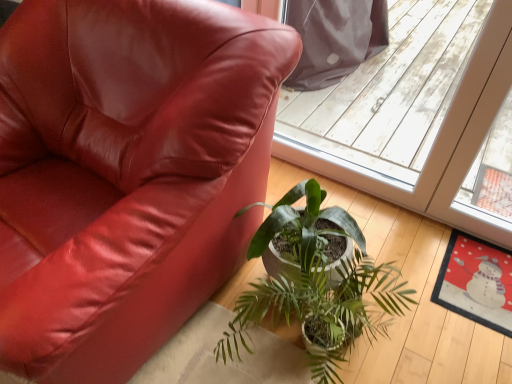
You are a GUI agent. You are given a task and a screenshot of the screen. Output one action in this format:
    pyautogui.click(x=<x>, y=<y>)
    Task: Click on the free spot to the right of green glossy plant at center
    The image size is (512, 384).
    Given the screenshot: What is the action you would take?
    pyautogui.click(x=423, y=339)